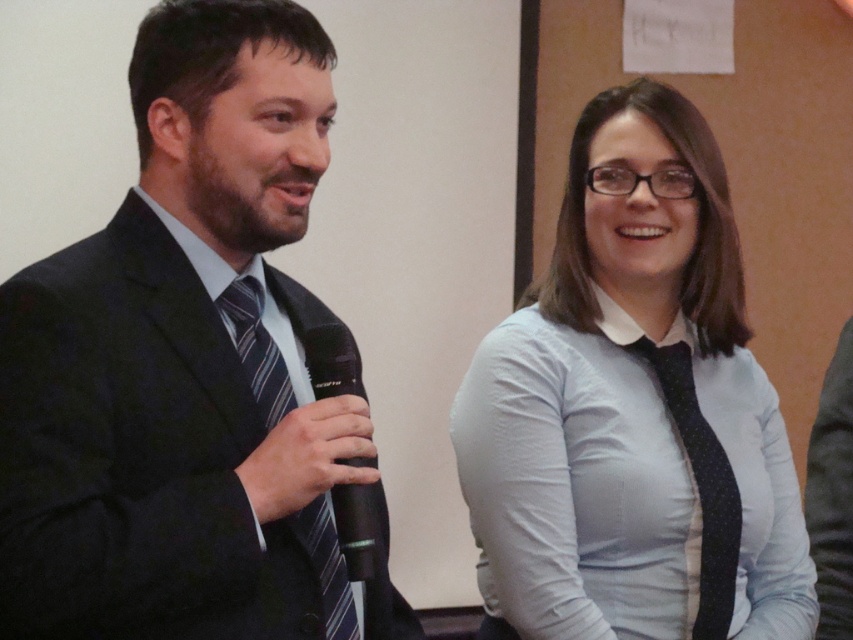
Is striped fabric tie at left smaller than black plastic microphone at center?

Indeed, striped fabric tie at left has a smaller size compared to black plastic microphone at center.

Can you confirm if striped fabric tie at left is taller than black plastic microphone at center?

Correct, striped fabric tie at left is much taller as black plastic microphone at center.

What are the coordinates of `striped fabric tie at left` in the screenshot? It's located at (257, 349).

Can you confirm if light blue shirt at center is positioned to the left of black plastic microphone at center?

No, light blue shirt at center is not to the left of black plastic microphone at center.

Which is below, light blue shirt at center or black plastic microphone at center?

Positioned lower is black plastic microphone at center.

Identify the location of light blue shirt at center. (633, 412).

Can you confirm if black dotted tie at center is thinner than black plastic microphone at center?

Incorrect, black dotted tie at center's width is not less than black plastic microphone at center's.

Does point (701, 528) come closer to viewer compared to point (364, 545)?

No, it is not.

This screenshot has width=853, height=640. I want to click on black dotted tie at center, so click(701, 484).